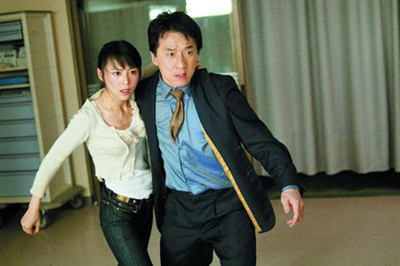
Find the location of a particular element. The width and height of the screenshot is (400, 266). room in background is located at coordinates (90, 84), (225, 259).